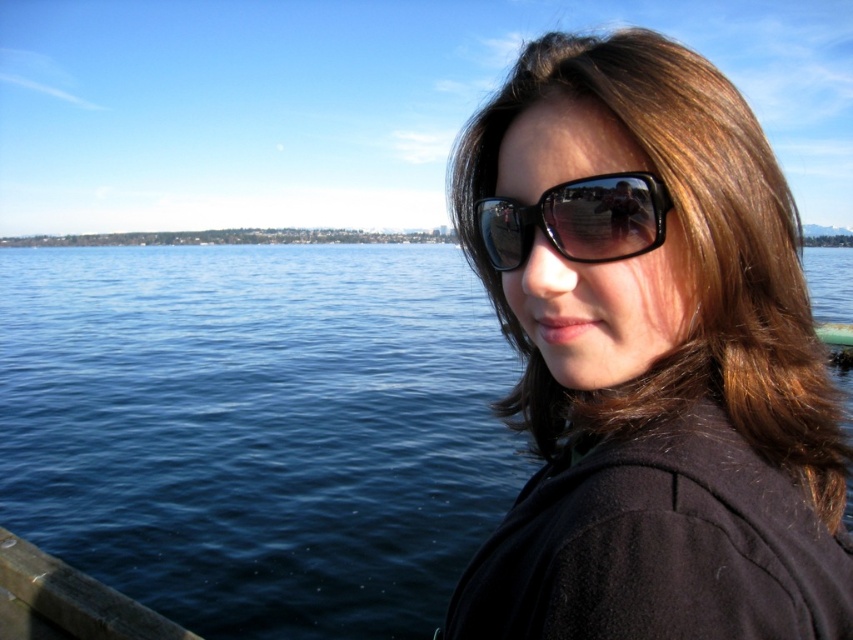
Locate an element on the screen. This screenshot has height=640, width=853. blue water at left is located at coordinates (257, 429).

Is blue water at left above black reflective sunglasses at center?

Correct, blue water at left is located above black reflective sunglasses at center.

The image size is (853, 640). What do you see at coordinates (257, 429) in the screenshot?
I see `blue water at left` at bounding box center [257, 429].

Find the location of `blue water at left`. blue water at left is located at coordinates (257, 429).

This screenshot has width=853, height=640. What do you see at coordinates (650, 358) in the screenshot? I see `sunglasses at right` at bounding box center [650, 358].

Who is shorter, sunglasses at right or blue water at left?

With less height is sunglasses at right.

Is point (508, 324) positioned after point (276, 440)?

No, (508, 324) is closer to viewer.

The image size is (853, 640). In order to click on sunglasses at right in this screenshot , I will do `click(650, 358)`.

Can you confirm if sunglasses at right is positioned below black reflective sunglasses at center?

Yes.

Between sunglasses at right and black reflective sunglasses at center, which one is positioned higher?

black reflective sunglasses at center is higher up.

This screenshot has height=640, width=853. What do you see at coordinates (650, 358) in the screenshot?
I see `sunglasses at right` at bounding box center [650, 358].

This screenshot has width=853, height=640. In order to click on sunglasses at right in this screenshot , I will do `click(650, 358)`.